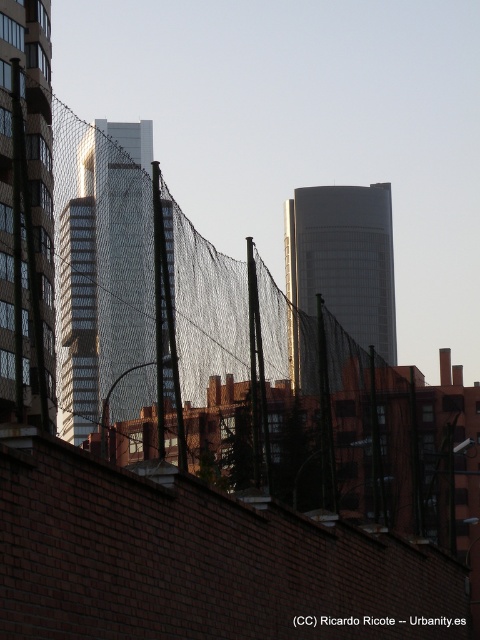
Can you confirm if matte glass skyscraper at left is shorter than smooth glass skyscraper at center?

Indeed, matte glass skyscraper at left has a lesser height compared to smooth glass skyscraper at center.

Between matte glass skyscraper at left and smooth glass skyscraper at center, which one appears on the right side from the viewer's perspective?

matte glass skyscraper at left

Where is `matte glass skyscraper at left`? matte glass skyscraper at left is located at coordinates (25, 214).

Which is more to the right, smooth glass skyscraper at center or smooth glass tower at center?

smooth glass tower at center

Where is `smooth glass skyscraper at center`? smooth glass skyscraper at center is located at coordinates (120, 243).

Does point (108, 198) lie in front of point (348, 324)?

Yes, point (108, 198) is closer to viewer.

Locate an element on the screen. The height and width of the screenshot is (640, 480). smooth glass skyscraper at center is located at coordinates (120, 243).

Between matte glass skyscraper at left and smooth glass tower at center, which one has more height?

smooth glass tower at center

Measure the distance between matte glass skyscraper at left and camera.

matte glass skyscraper at left is 93.53 feet away from camera.

The width and height of the screenshot is (480, 640). Describe the element at coordinates (25, 214) in the screenshot. I see `matte glass skyscraper at left` at that location.

Locate an element on the screen. The image size is (480, 640). matte glass skyscraper at left is located at coordinates (25, 214).